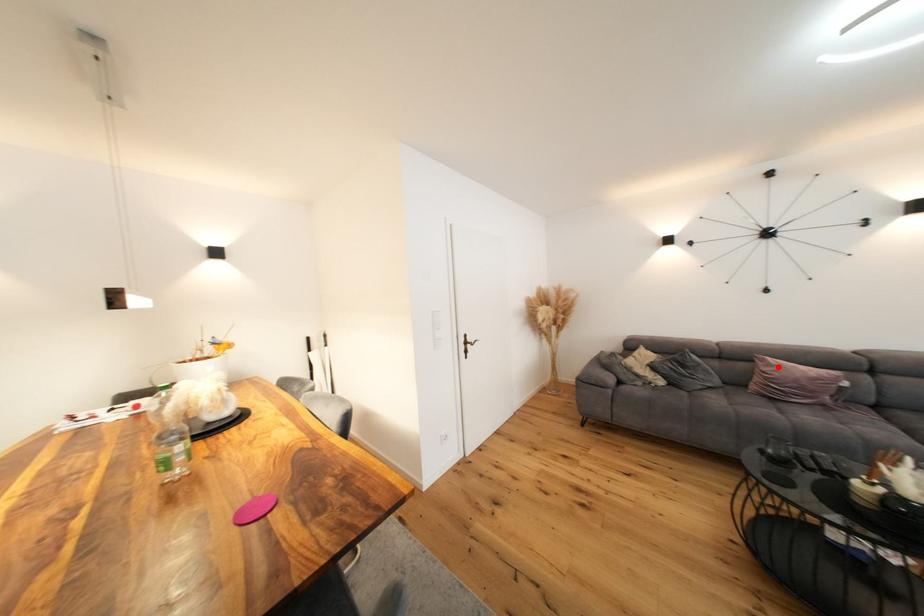
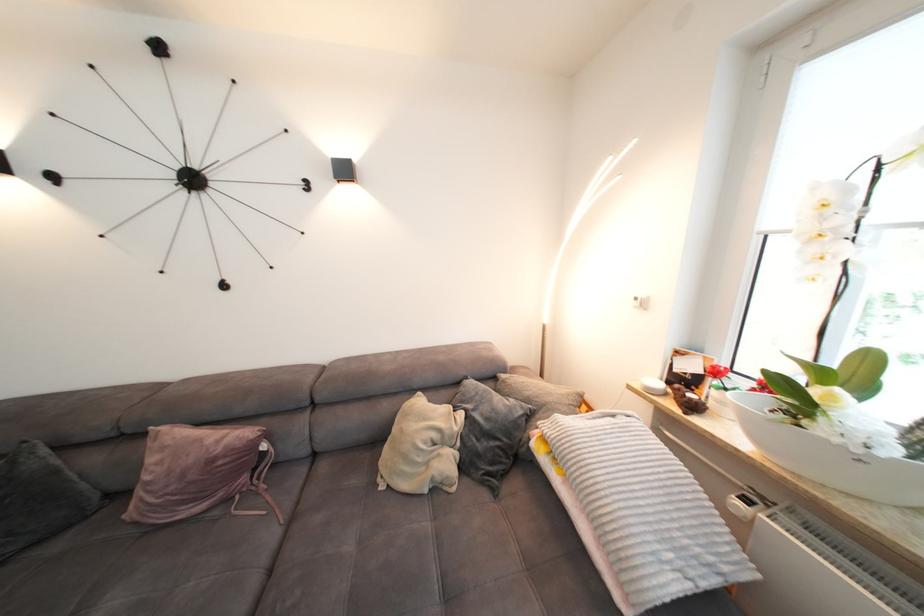
Question: I am providing you with two images of the same scene from different viewpoints. A red point is marked on the first image. At the location where the point appears in image 1, is it still visible in image 2?

Choices:
 (A) Yes
 (B) No

Answer: (A)